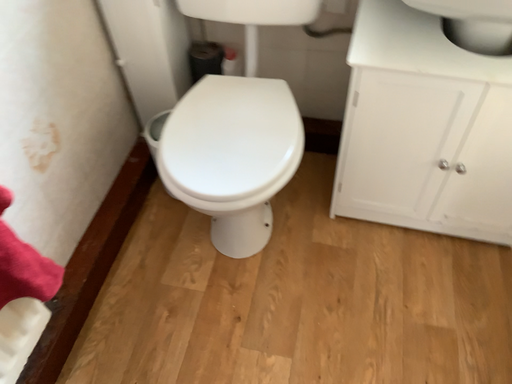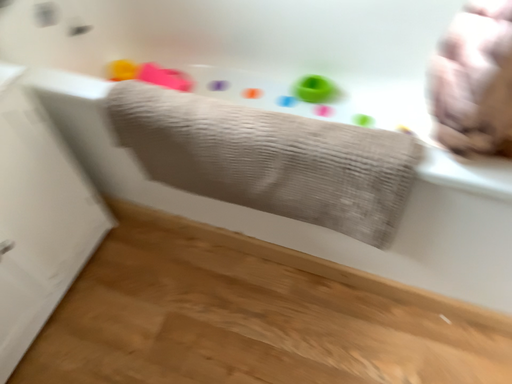
Question: How did the camera likely rotate when shooting the video?

Choices:
 (A) rotated upward
 (B) rotated downward

Answer: (A)